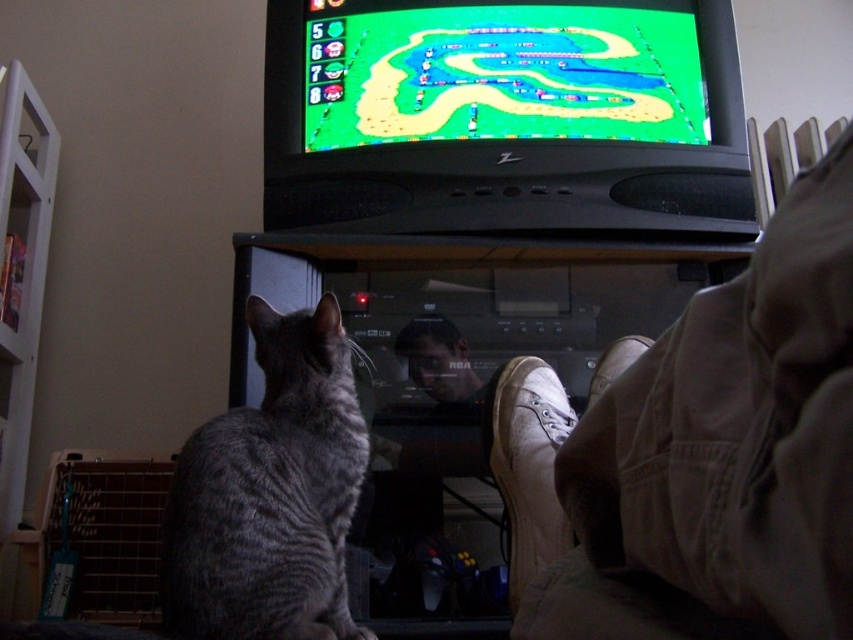
You are standing in the room and see the point marked at coordinates (527,465). What object is located at that point?

The point at coordinates (527,465) indicates the white canvas shoe at lower right.

Consider the image. You are a delivery robot entering a living room and need to place a small package on the floor near the white canvas shoe at lower right without blocking the smooth skin face at center. Can you fit the package between them?

The white canvas shoe at lower right has a larger size compared to smooth skin face at center, so yes, there is enough space to place the package between them without blocking the smooth skin face at center.

You are a game developer analyzing the TV screen. The green matte track at upper center and the smooth skin face at center are both visible on the screen. Which object takes up more space on the screen?

The green matte track at upper center has a larger size compared to the smooth skin face at center, so it takes up more space on the screen.